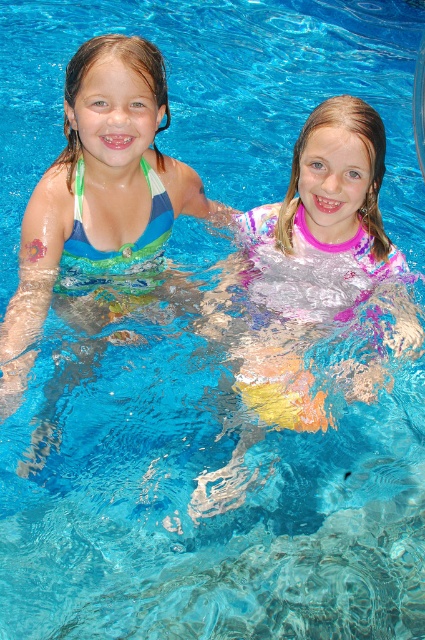
Who is higher up, multicolored fabric swimsuit at center or matte blue swimsuit at left?

Positioned higher is matte blue swimsuit at left.

Between multicolored fabric swimsuit at center and matte blue swimsuit at left, which one is positioned lower?

Positioned lower is multicolored fabric swimsuit at center.

Is point (388, 262) positioned in front of point (17, 353)?

No, (388, 262) is further to viewer.

Find the location of a particular element. Image resolution: width=425 pixels, height=640 pixels. multicolored fabric swimsuit at center is located at coordinates (314, 253).